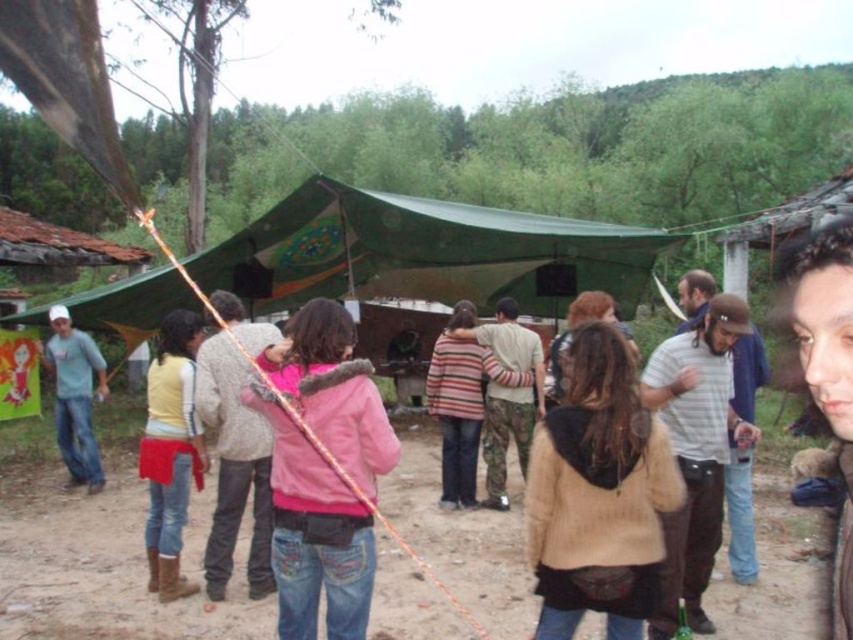
Describe the element at coordinates (314, 534) in the screenshot. I see `pink fleece jacket at center` at that location.

Is pink fleece jacket at center above yellow-green sweater at center-left?

Yes, pink fleece jacket at center is above yellow-green sweater at center-left.

Which is in front, point (335, 316) or point (180, 392)?

Point (335, 316)

Find the location of a particular element. This screenshot has width=853, height=640. pink fleece jacket at center is located at coordinates click(x=314, y=534).

From the picture: Does brown fuzzy coat at center come behind striped sweater at center?

No.

Who is more forward, (585, 429) or (527, 380)?

Point (585, 429)

Identify the location of brown fuzzy coat at center. The height and width of the screenshot is (640, 853). (598, 493).

Who is more forward, (149, 362) or (476, 435)?

Point (476, 435)

Is point (181, 540) positioned behind point (540, 369)?

No, (181, 540) is closer to viewer.

Is point (187, 362) less distant than point (473, 332)?

Yes.

Find the location of `yellow-green sweater at center-left`. yellow-green sweater at center-left is located at coordinates (170, 451).